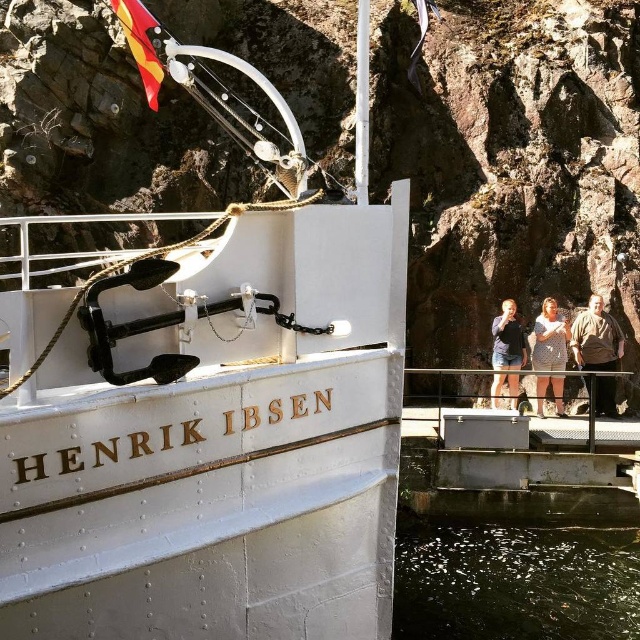
Question: Can you confirm if brown leather jacket at right is wider than light brown fabric dress at center?

Choices:
 (A) yes
 (B) no

Answer: (A)

Question: Among these objects, which one is farthest from the camera?

Choices:
 (A) dark reflective water at lower center
 (B) light brown fabric dress at center
 (C) denim shorts at center

Answer: (B)

Question: Does brown leather jacket at right have a lesser width compared to light brown fabric dress at center?

Choices:
 (A) no
 (B) yes

Answer: (A)

Question: Is white polished wood boat at center to the left of polished wood flag at upper left from the viewer's perspective?

Choices:
 (A) yes
 (B) no

Answer: (B)

Question: Based on their relative distances, which object is nearer to the polished wood flag at upper left?

Choices:
 (A) dark reflective water at lower center
 (B) rusty rock cliff at upper center
 (C) brown leather jacket at right
 (D) light brown fabric dress at center

Answer: (B)

Question: Which point is farther to the camera?

Choices:
 (A) (516, 387)
 (B) (605, 323)
 (C) (77, 100)

Answer: (C)